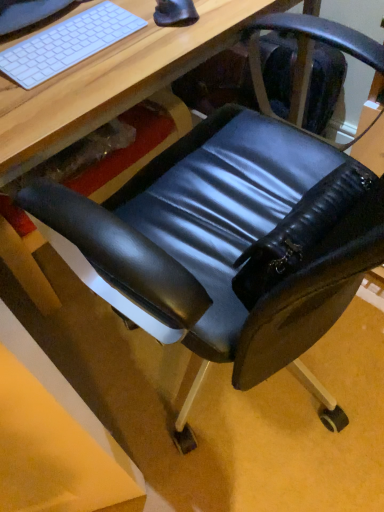
Where is `vacant area that is situated to the right of white matte keyboard at upper left`? vacant area that is situated to the right of white matte keyboard at upper left is located at coordinates (152, 39).